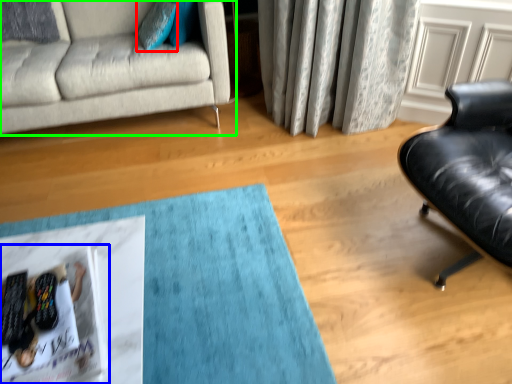
Question: Which object is positioned farthest from pillow (highlighted by a red box)? Select from magazine (highlighted by a blue box) and studio couch (highlighted by a green box).

Choices:
 (A) magazine
 (B) studio couch

Answer: (A)